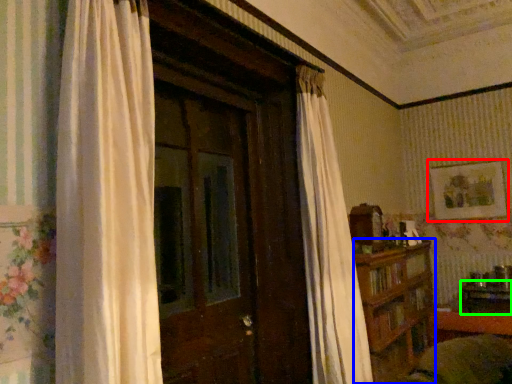
Question: Estimate the real-world distances between objects in this image. Which object is farther from picture frame (highlighted by a red box), furniture (highlighted by a blue box) or table (highlighted by a green box)?

Choices:
 (A) furniture
 (B) table

Answer: (A)